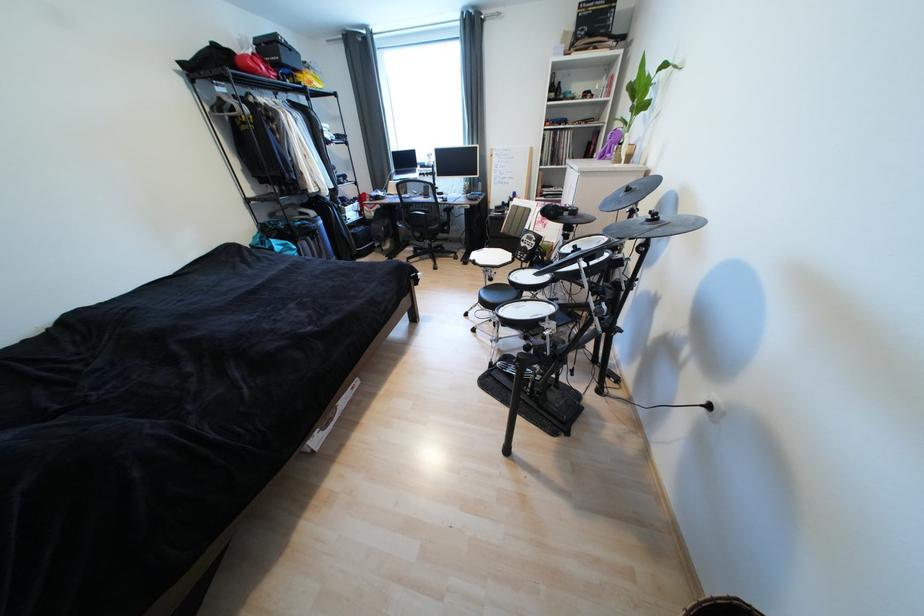
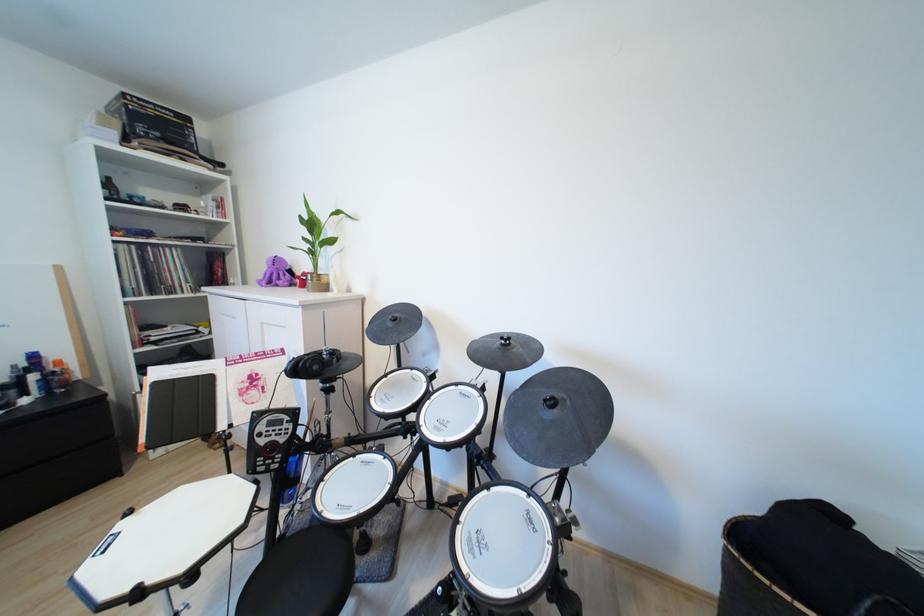
Locate, in the second image, the point that corresponds to [517,276] in the first image.

(326, 515)